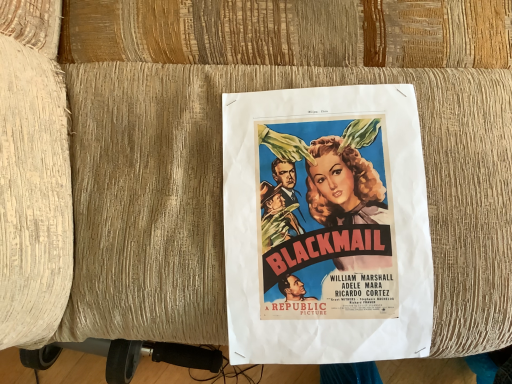
Find the location of a particular element. Image resolution: width=512 pixels, height=384 pixels. matte paper poster at center is located at coordinates (326, 226).

The width and height of the screenshot is (512, 384). What do you see at coordinates (326, 226) in the screenshot? I see `matte paper poster at center` at bounding box center [326, 226].

Locate an element on the screen. Image resolution: width=512 pixels, height=384 pixels. matte paper poster at center is located at coordinates (326, 226).